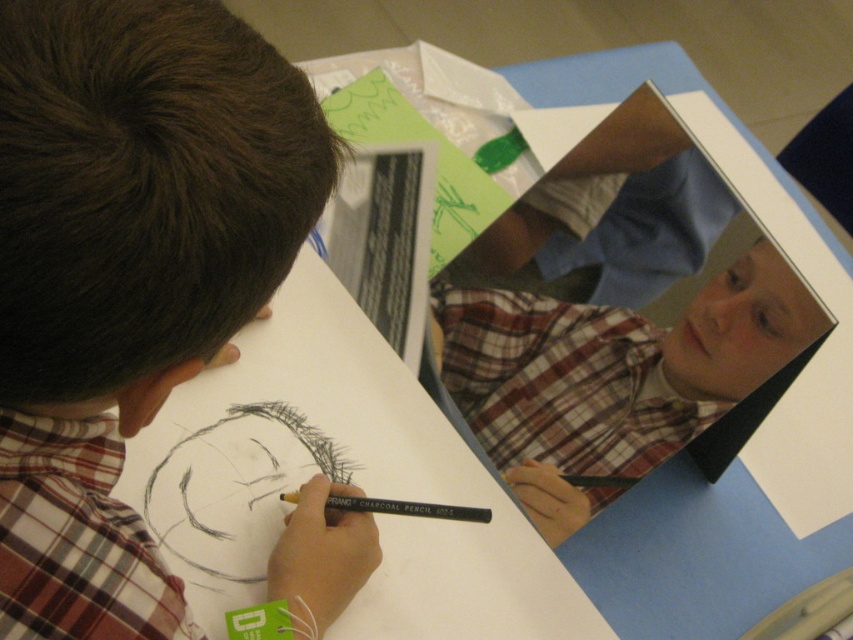
Question: Can you confirm if plaid shirt at upper left is positioned above charcoal pencil at center?

Choices:
 (A) no
 (B) yes

Answer: (B)

Question: Which of the following is the closest to the observer?

Choices:
 (A) (90, 84)
 (B) (341, 497)

Answer: (A)

Question: Which of the following is the farthest from the observer?

Choices:
 (A) (4, 221)
 (B) (299, 496)

Answer: (B)

Question: Is plaid shirt at upper left below charcoal pencil at center?

Choices:
 (A) yes
 (B) no

Answer: (B)

Question: Can you confirm if plaid shirt at upper left is bigger than charcoal pencil at center?

Choices:
 (A) yes
 (B) no

Answer: (A)